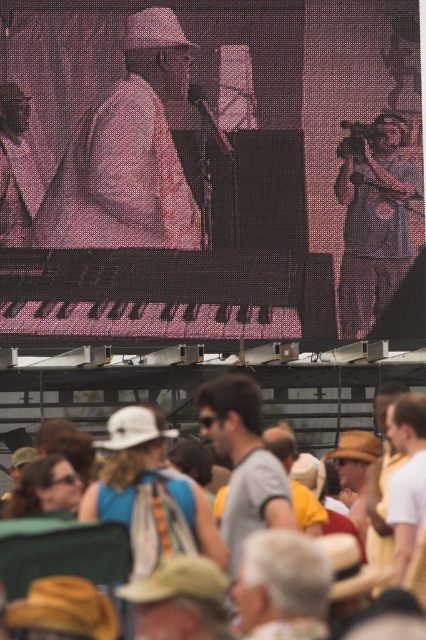
You are standing in the crowd at the outdoor concert and want to know which of the two points, point (54, 204) or point (126, 515), is closer to you. Can you determine this based on their positions?

Point (54, 204) is further to the viewer than point (126, 515), so point (126, 515) is closer to you.

You are a photographer at the concert and want to capture both the matte white hat at center and the white woven hat at center in a single frame. Which hat will appear smaller in the photo?

The matte white hat at center will appear smaller in the photo because it has a lesser width compared to the white woven hat at center.